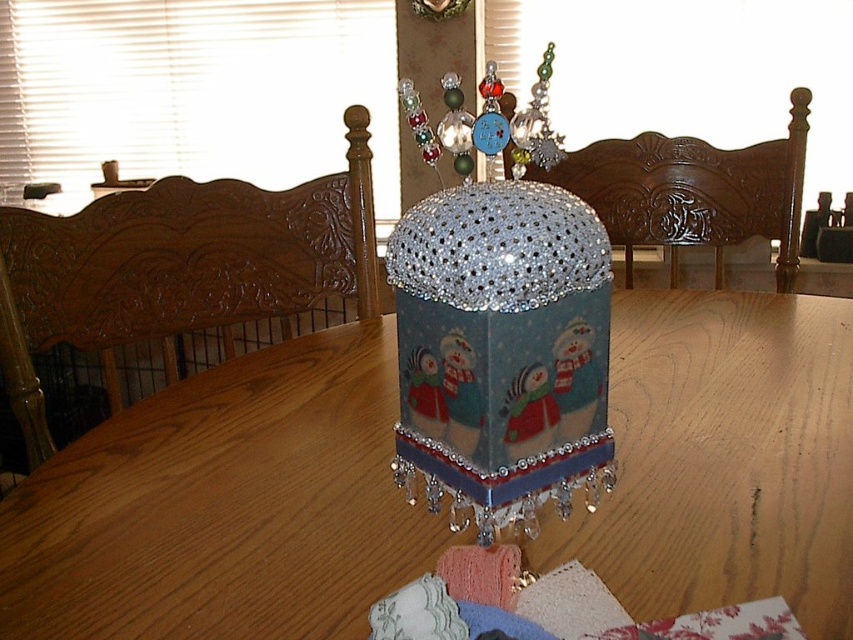
You are arranging a winter themed dinner and need to place a centerpiece on the table. Given the current setup, where is the glittery plastic snowman at center in relation to the wooden table at center?

The wooden table at center is positioned on the right side of the glittery plastic snowman at center, so the snowman is located to the left of the wooden table at center.

You are hosting a winter party and want to place a large centerpiece on the wooden table at center. The glittery plastic snowman at center is currently on the table. Can you fit a centerpiece that is larger than the snowman on the table?

The wooden table at center is bigger than the glittery plastic snowman at center, so yes, you can fit a larger centerpiece on the table since there is enough space.